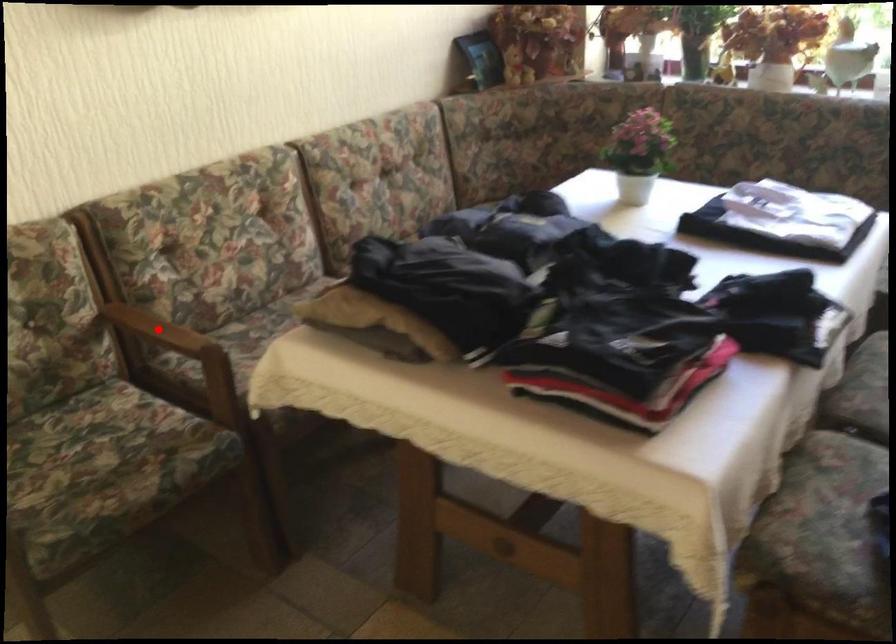
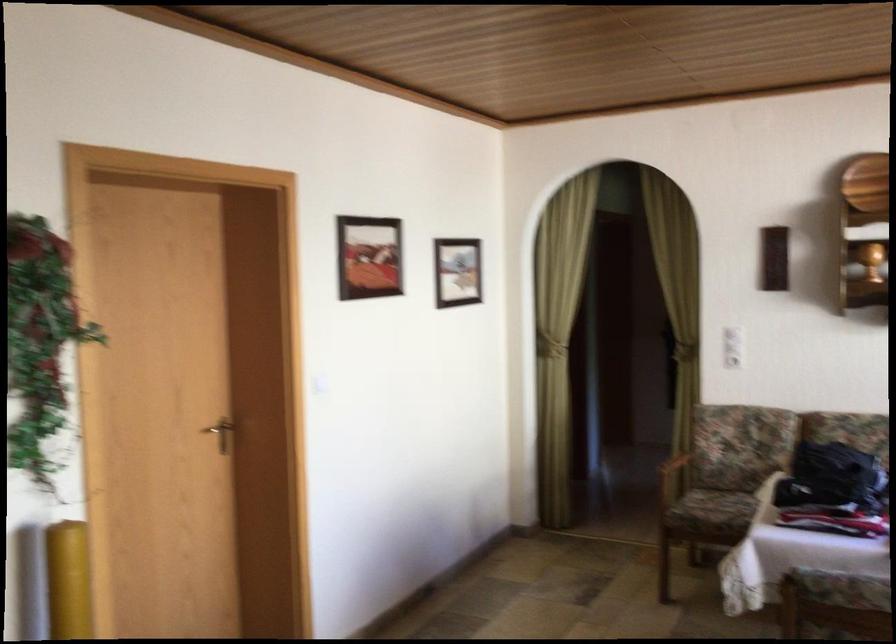
Question: I am providing you with two images of the same scene from different viewpoints. A red point is marked on the first image. Can you still see the location of the red point in image 2?

Choices:
 (A) Yes
 (B) No

Answer: (B)